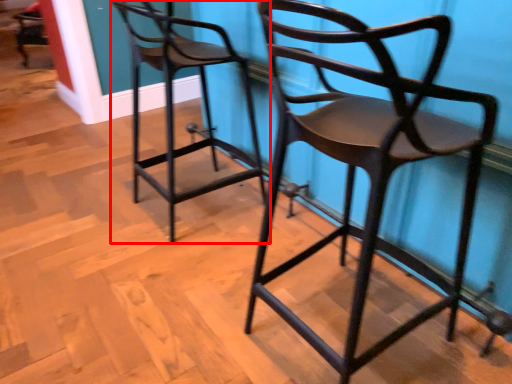
Question: Observing the image, what is the correct spatial positioning of chair (annotated by the red box) in reference to chair?

Choices:
 (A) right
 (B) left

Answer: (B)